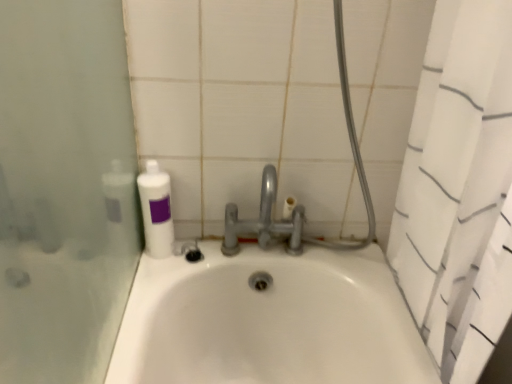
Question: Is the depth of satin nickel faucet at center less than that of white matte bottle at upper left?

Choices:
 (A) no
 (B) yes

Answer: (B)

Question: Is satin nickel faucet at center not within white matte bottle at upper left?

Choices:
 (A) yes
 (B) no

Answer: (A)

Question: Can you confirm if satin nickel faucet at center is bigger than white matte bottle at upper left?

Choices:
 (A) yes
 (B) no

Answer: (A)

Question: Can you confirm if satin nickel faucet at center is smaller than white matte bottle at upper left?

Choices:
 (A) no
 (B) yes

Answer: (A)

Question: From a real-world perspective, does satin nickel faucet at center sit lower than white matte bottle at upper left?

Choices:
 (A) yes
 (B) no

Answer: (B)

Question: From the image's perspective, relative to satin nickel faucet at center, is white textured shower curtain at right above or below?

Choices:
 (A) above
 (B) below

Answer: (B)

Question: Looking at the image, does white textured shower curtain at right seem bigger or smaller compared to satin nickel faucet at center?

Choices:
 (A) big
 (B) small

Answer: (A)

Question: In terms of width, does white textured shower curtain at right look wider or thinner when compared to satin nickel faucet at center?

Choices:
 (A) thin
 (B) wide

Answer: (B)

Question: Visually, is white textured shower curtain at right positioned to the left or to the right of satin nickel faucet at center?

Choices:
 (A) left
 (B) right

Answer: (B)

Question: From a real-world perspective, is satin nickel faucet at center above or below white textured shower curtain at right?

Choices:
 (A) below
 (B) above

Answer: (B)

Question: In the image, is satin nickel faucet at center positioned in front of or behind white textured shower curtain at right?

Choices:
 (A) behind
 (B) front

Answer: (A)

Question: From the image's perspective, is satin nickel faucet at center located above or below white textured shower curtain at right?

Choices:
 (A) below
 (B) above

Answer: (B)

Question: Considering the positions of satin nickel faucet at center and white textured shower curtain at right in the image, is satin nickel faucet at center taller or shorter than white textured shower curtain at right?

Choices:
 (A) short
 (B) tall

Answer: (A)

Question: Relative to white textured shower curtain at right, is white matte bottle at upper left in front or behind?

Choices:
 (A) front
 (B) behind

Answer: (B)

Question: In terms of width, does white matte bottle at upper left look wider or thinner when compared to white textured shower curtain at right?

Choices:
 (A) wide
 (B) thin

Answer: (B)